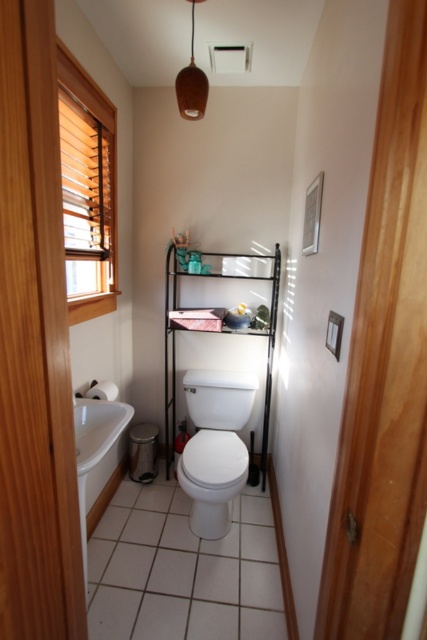
Question: Which object appears farthest from the camera in this image?

Choices:
 (A) white glossy sink at lower left
 (B) white glossy toilet at center

Answer: (B)

Question: Is white glossy toilet at center positioned in front of white glossy sink at lower left?

Choices:
 (A) yes
 (B) no

Answer: (B)

Question: Which point is closer to the camera taking this photo?

Choices:
 (A) (193, 392)
 (B) (114, 416)

Answer: (B)

Question: Which of the following is the closest to the observer?

Choices:
 (A) (81, 413)
 (B) (215, 429)

Answer: (A)

Question: Does white glossy toilet at center appear on the right side of white glossy sink at lower left?

Choices:
 (A) yes
 (B) no

Answer: (A)

Question: Does white glossy toilet at center appear on the right side of white glossy sink at lower left?

Choices:
 (A) no
 (B) yes

Answer: (B)